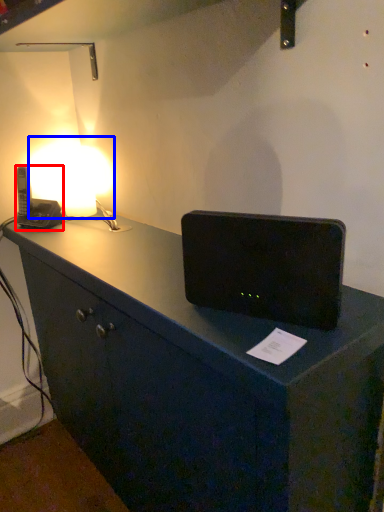
Question: Which of the following is the farthest to the observer, gadget (highlighted by a red box) or lamp (highlighted by a blue box)?

Choices:
 (A) gadget
 (B) lamp

Answer: (B)